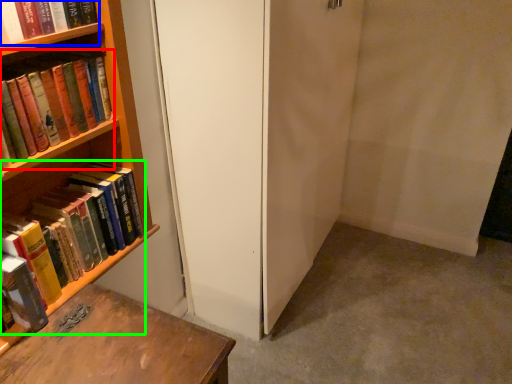
Question: Which object is positioned farthest from book (highlighted by a red box)? Select from book (highlighted by a blue box) and book (highlighted by a green box).

Choices:
 (A) book
 (B) book

Answer: (B)